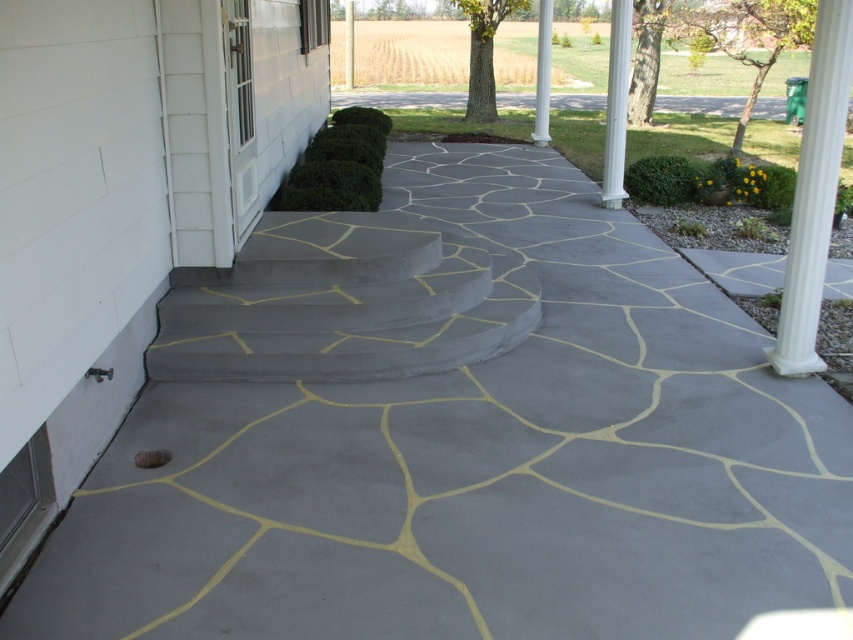
Based on the photo, between white smooth column at right and white smooth column at upper center, which one is positioned lower?

white smooth column at right is below.

Is point (821, 170) less distant than point (548, 77)?

That is True.

Who is more forward, (x=781, y=308) or (x=543, y=141)?

Point (x=781, y=308)

Where is `white smooth column at right`? The height and width of the screenshot is (640, 853). white smooth column at right is located at coordinates [x=814, y=192].

Is white smooth column at upper center bigger than gray concrete pillar at center?

Incorrect, white smooth column at upper center is not larger than gray concrete pillar at center.

Who is more distant from viewer, (538,134) or (347,22)?

Point (347,22)

Who is more distant from viewer, (537, 83) or (347, 44)?

Point (347, 44)

Locate an element on the screen. The image size is (853, 640). white smooth column at upper center is located at coordinates (543, 74).

What are the coordinates of `gray concrete stairs at center` in the screenshot? It's located at (341, 304).

Does point (219, 348) lie in front of point (628, 17)?

That is True.

In order to click on gray concrete stairs at center in this screenshot , I will do `click(341, 304)`.